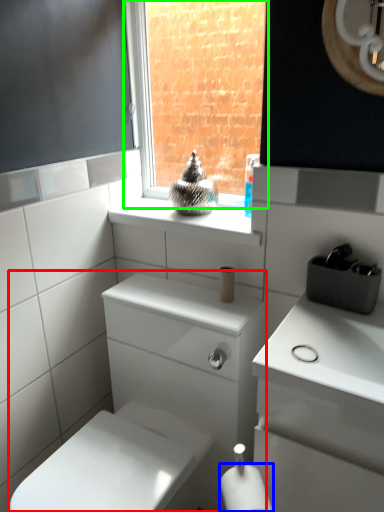
Question: Which object is the farthest from porcelain (highlighted by a red box)? Choose among these: toilet paper (highlighted by a blue box) or window (highlighted by a green box).

Choices:
 (A) toilet paper
 (B) window

Answer: (B)